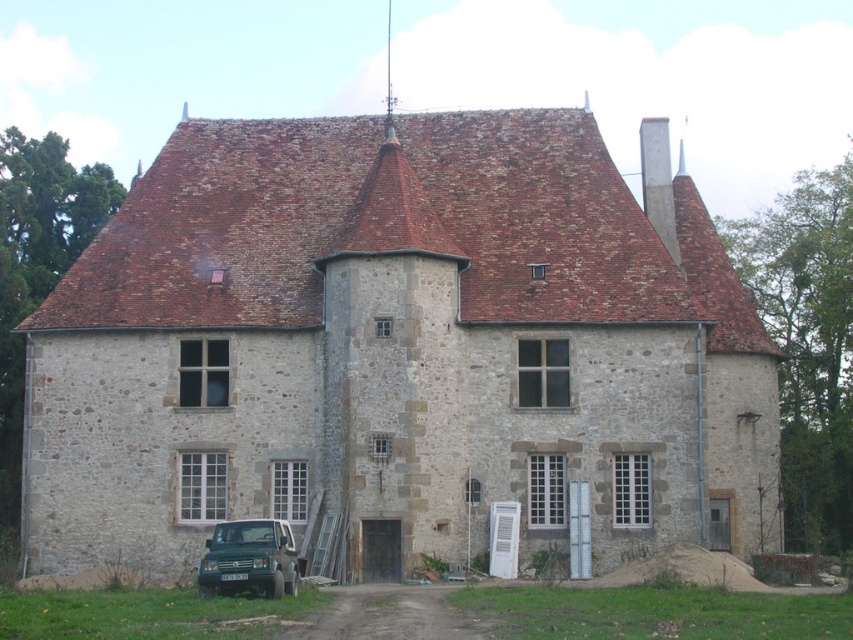
Between green matte suv at lower center and white concrete chimney at upper center, which one has less height?

Standing shorter between the two is green matte suv at lower center.

Does green matte suv at lower center have a greater height compared to white concrete chimney at upper center?

Incorrect, green matte suv at lower center's height is not larger of white concrete chimney at upper center's.

The image size is (853, 640). What do you see at coordinates (248, 560) in the screenshot?
I see `green matte suv at lower center` at bounding box center [248, 560].

Locate an element on the screen. This screenshot has width=853, height=640. green matte suv at lower center is located at coordinates (248, 560).